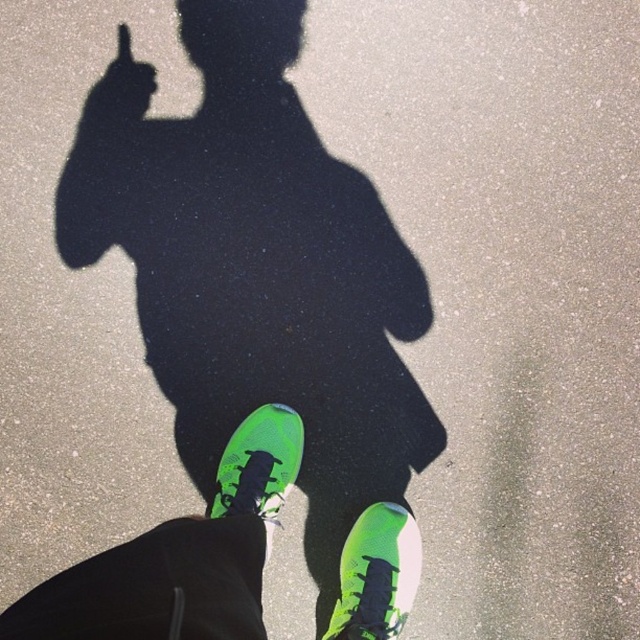
Does neon green rubber shoe at center have a lesser width compared to green matte hand at upper left?

No, neon green rubber shoe at center is not thinner than green matte hand at upper left.

From the picture: Who is taller, neon green rubber shoe at center or green matte hand at upper left?

neon green rubber shoe at center is taller.

Between point (273, 436) and point (113, 88), which one is positioned in front?

Point (273, 436) is in front.

I want to click on neon green rubber shoe at center, so click(259, 465).

Locate an element on the screen. This screenshot has width=640, height=640. neon green sneakers at center is located at coordinates (260, 273).

Is point (154, 128) behind point (257, 508)?

Yes, point (154, 128) is behind point (257, 508).

The width and height of the screenshot is (640, 640). In order to click on neon green sneakers at center in this screenshot , I will do `click(260, 273)`.

Between point (362, 576) and point (252, 426), which one is positioned in front?

Point (362, 576)

Between point (384, 536) and point (280, 493), which one is positioned behind?

Positioned behind is point (280, 493).

The image size is (640, 640). In order to click on neon green synthetic shoe at lower center in this screenshot , I will do `click(376, 573)`.